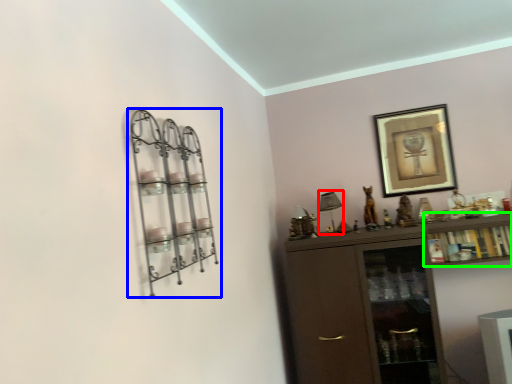
Question: Which object is the closest to the lamp (highlighted by a red box)? Choose among these: shelf (highlighted by a blue box) or cabinet (highlighted by a green box).

Choices:
 (A) shelf
 (B) cabinet

Answer: (B)